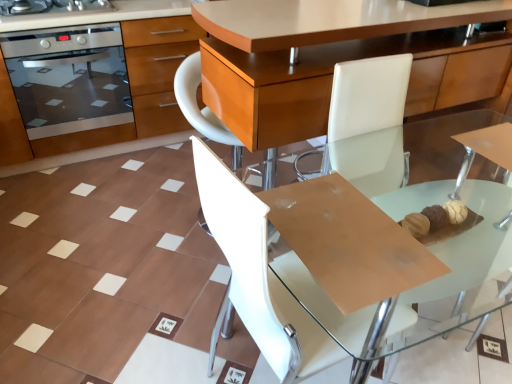
Where is `free point to the left of white leather chair at center`? The width and height of the screenshot is (512, 384). free point to the left of white leather chair at center is located at coordinates (175, 339).